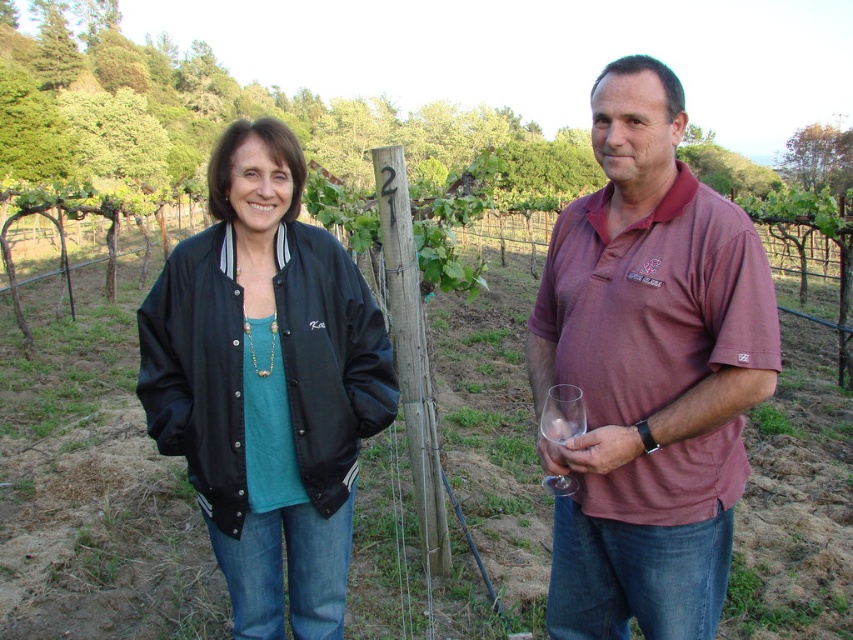
Question: Based on their relative distances, which object is farther from the clear glass at right?

Choices:
 (A) matte maroon polo shirt at center
 (B) black leather jacket at left
 (C) black leather jacket at center

Answer: (C)

Question: Does black leather jacket at left appear under black leather jacket at center?

Choices:
 (A) yes
 (B) no

Answer: (A)

Question: Which of the following is the closest to the observer?

Choices:
 (A) black leather jacket at center
 (B) black leather jacket at left

Answer: (B)

Question: Can you confirm if black leather jacket at left is wider than black leather jacket at center?

Choices:
 (A) yes
 (B) no

Answer: (B)

Question: Among these objects, which one is farthest from the camera?

Choices:
 (A) clear glass at right
 (B) matte maroon polo shirt at center

Answer: (A)

Question: Can you confirm if black leather jacket at left is positioned above clear glass at right?

Choices:
 (A) yes
 (B) no

Answer: (B)